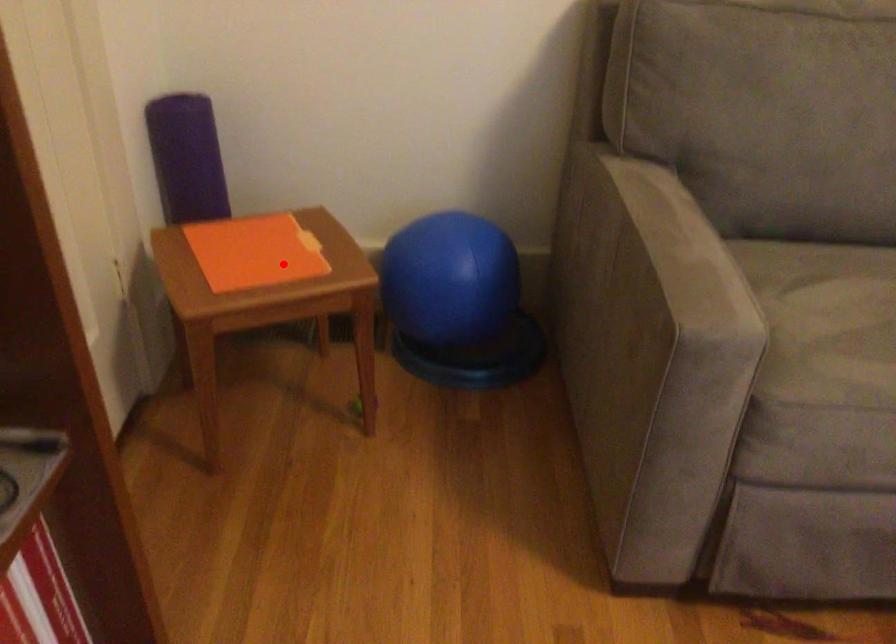
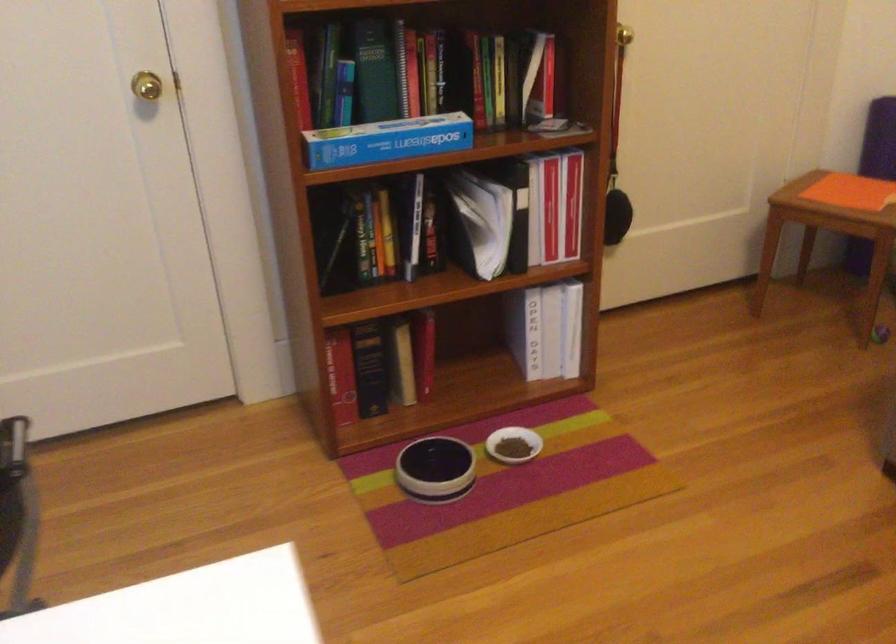
Question: I am providing you with two images of the same scene from different viewpoints. Given a red point in image1, look at the same physical point in image2. Is it:

Choices:
 (A) Closer to the viewpoint
 (B) Farther from the viewpoint

Answer: (B)